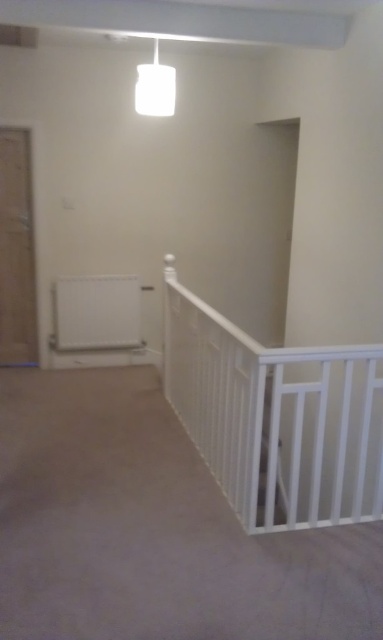
Who is positioned more to the left, wooden door at left or white glossy pendant light at upper center?

Positioned to the left is wooden door at left.

Can you confirm if wooden door at left is smaller than white glossy pendant light at upper center?

Actually, wooden door at left might be larger than white glossy pendant light at upper center.

Between point (13, 266) and point (147, 115), which one is positioned behind?

Positioned behind is point (13, 266).

This screenshot has height=640, width=383. What are the coordinates of `wooden door at left` in the screenshot? It's located at 16,252.

Does wooden door at left appear on the left side of white wooden stair at center?

Correct, you'll find wooden door at left to the left of white wooden stair at center.

Between wooden door at left and white wooden stair at center, which one is positioned higher?

wooden door at left is higher up.

The height and width of the screenshot is (640, 383). What do you see at coordinates (16, 252) in the screenshot?
I see `wooden door at left` at bounding box center [16, 252].

The height and width of the screenshot is (640, 383). What are the coordinates of `wooden door at left` in the screenshot? It's located at (16, 252).

Consider the image. Is white wooden rail at center to the left of white wooden stair at center from the viewer's perspective?

No, white wooden rail at center is not to the left of white wooden stair at center.

Does point (270, 396) come in front of point (260, 451)?

No, it is behind (260, 451).

At what (x,y) coordinates should I click in order to perform the action: click on white wooden rail at center. Please return your answer as a coordinate pair (x, y). This screenshot has height=640, width=383. Looking at the image, I should click on (276, 417).